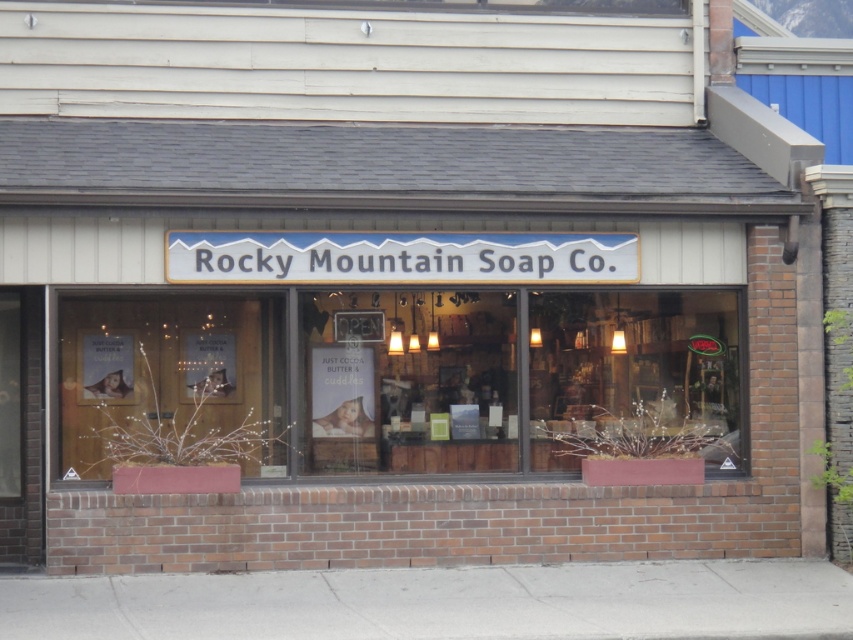
Question: Is wooden display case at center behind clear glass window at lower left?

Choices:
 (A) no
 (B) yes

Answer: (A)

Question: Which object is the farthest from the white plastic sign at center?

Choices:
 (A) translucent glass window at center
 (B) wooden display case at center
 (C) clear glass window at lower left

Answer: (C)

Question: Does wooden door at center appear on the left side of translucent glass window at center?

Choices:
 (A) yes
 (B) no

Answer: (A)

Question: Does wooden display case at center have a lesser width compared to white plastic sign at center?

Choices:
 (A) no
 (B) yes

Answer: (B)

Question: Which object is farther from the camera taking this photo?

Choices:
 (A) translucent glass window at center
 (B) clear glass window at lower left
 (C) wooden door at center

Answer: (C)

Question: Which object is farther from the camera taking this photo?

Choices:
 (A) clear glass window at lower left
 (B) wooden display case at center
 (C) translucent glass window at center
 (D) white plastic sign at center

Answer: (A)